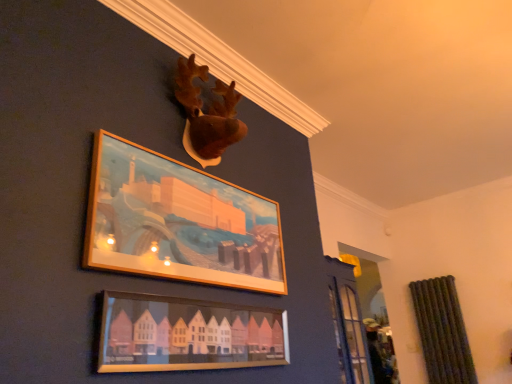
Question: Do you think brown plush moose head at upper center is within wooden frame at upper center, acting as the first picture frame starting from the top, or outside of it?

Choices:
 (A) outside
 (B) inside

Answer: (A)

Question: Looking at their shapes, would you say brown plush moose head at upper center is wider or thinner than wooden frame at upper center, acting as the first picture frame starting from the top?

Choices:
 (A) wide
 (B) thin

Answer: (A)

Question: Estimate the real-world distances between objects in this image. Which object is closer to the brown plush moose head at upper center?

Choices:
 (A) matte wooden picture frame at lower center, which ranks as the first picture frame in bottom-to-top order
 (B) wooden frame at upper center, the 2th picture frame ordered from the bottom

Answer: (B)

Question: Which of these objects is positioned closest to the matte wooden picture frame at lower center, which ranks as the first picture frame in bottom-to-top order?

Choices:
 (A) brown plush moose head at upper center
 (B) wooden frame at upper center, the 2th picture frame ordered from the bottom

Answer: (B)